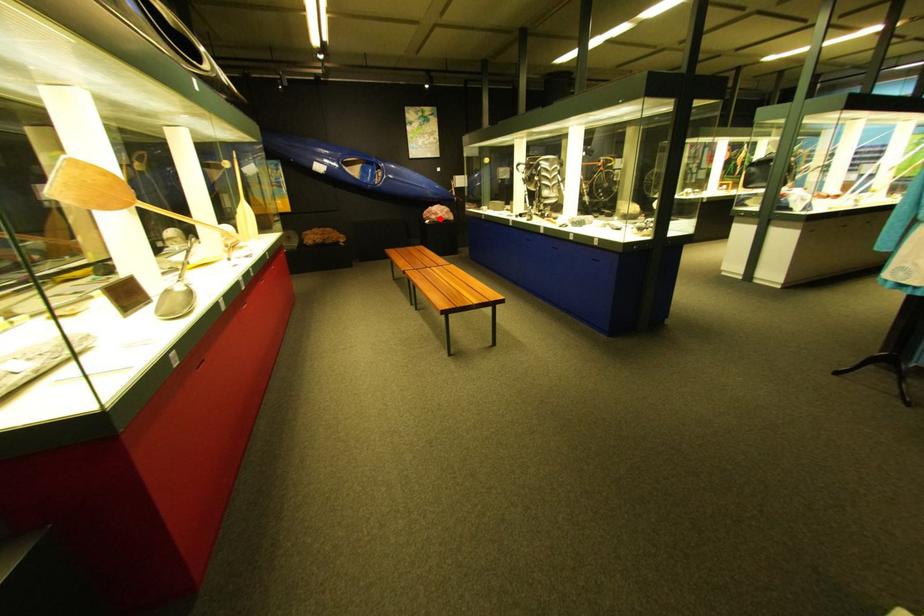
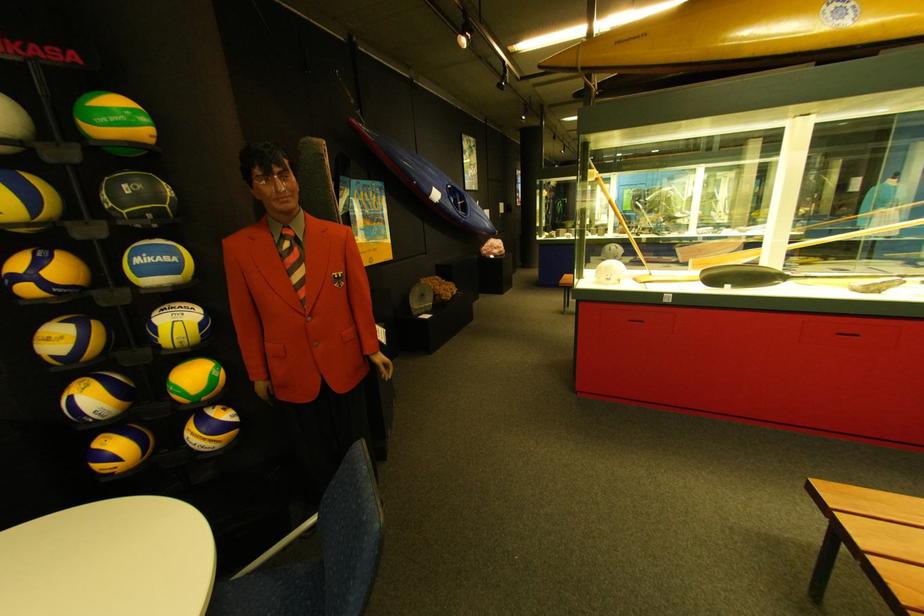
Question: I am providing you with two images of the same scene from different viewpoints. Given a red point in image1, look at the same physical point in image2. Is it:

Choices:
 (A) Closer to the viewpoint
 (B) Farther from the viewpoint

Answer: (B)